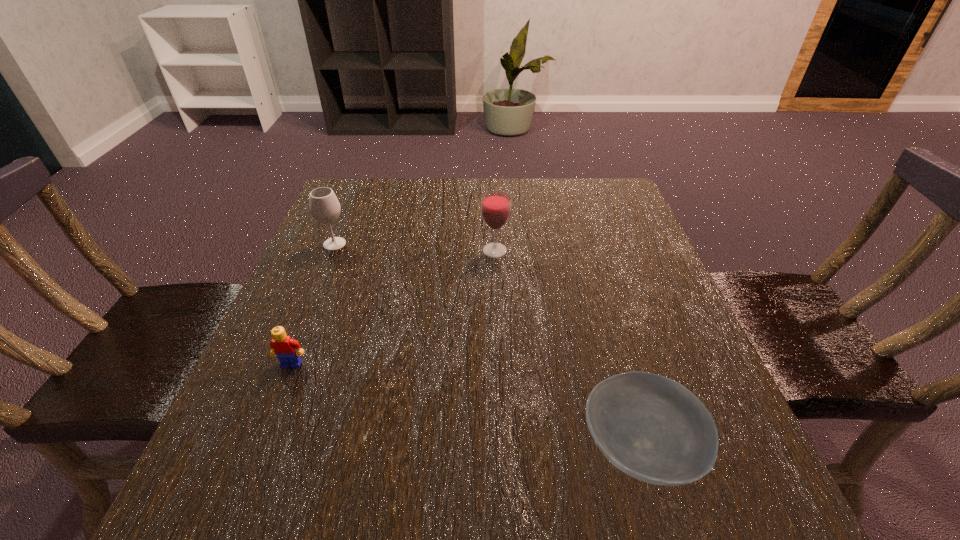
At what (x,y) coordinates should I click in order to perform the action: click on vacant area that lies between the shortest object and the left wineglass. Please return your answer as a coordinate pair (x, y). This screenshot has height=540, width=960. Looking at the image, I should click on (487, 346).

This screenshot has height=540, width=960. I want to click on empty location between the left wineglass and the right wineglass, so click(415, 247).

At what (x,y) coordinates should I click in order to perform the action: click on object that stands as the second closest to the Lego. Please return your answer as a coordinate pair (x, y). Looking at the image, I should click on (495, 205).

I want to click on object that is the closest one to the bowl, so (495, 205).

Identify the location of free space that satisfies the following two spatial constraints: 1. on the face of the rightmost object; 2. on the right side of the Lego. The height and width of the screenshot is (540, 960). (257, 448).

Identify the location of free location that satisfies the following two spatial constraints: 1. on the front side of the right wineglass; 2. on the left side of the bowl. The width and height of the screenshot is (960, 540). (503, 448).

Where is `free space that satisfies the following two spatial constraints: 1. on the front side of the second object from right to left; 2. on the left side of the rightmost object`? This screenshot has width=960, height=540. free space that satisfies the following two spatial constraints: 1. on the front side of the second object from right to left; 2. on the left side of the rightmost object is located at coordinates (503, 448).

Locate an element on the screen. The height and width of the screenshot is (540, 960). free region that satisfies the following two spatial constraints: 1. on the face of the rightmost object; 2. on the left side of the Lego is located at coordinates (257, 448).

You are a GUI agent. You are given a task and a screenshot of the screen. Output one action in this format:
    pyautogui.click(x=<x>, y=<y>)
    Task: Click on the vacant area in the image that satisfies the following two spatial constraints: 1. on the front side of the left wineglass; 2. on the right side of the right wineglass
    
    Given the screenshot: What is the action you would take?
    pyautogui.click(x=332, y=251)

You are a GUI agent. You are given a task and a screenshot of the screen. Output one action in this format:
    pyautogui.click(x=<x>, y=<y>)
    Task: Click on the free space that satisfies the following two spatial constraints: 1. on the face of the Lego; 2. on the right side of the rightmost object
    Image resolution: width=960 pixels, height=540 pixels.
    Given the screenshot: What is the action you would take?
    pyautogui.click(x=257, y=448)